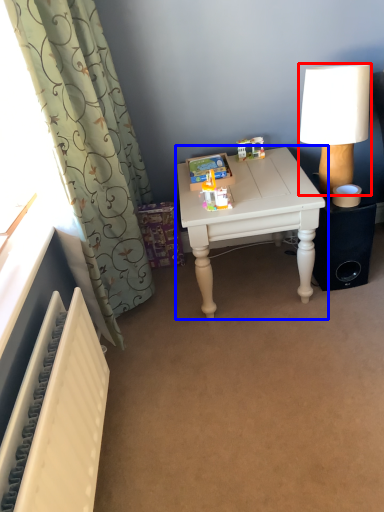
Question: Among these objects, which one is farthest to the camera, lamp (highlighted by a red box) or table (highlighted by a blue box)?

Choices:
 (A) lamp
 (B) table

Answer: (B)